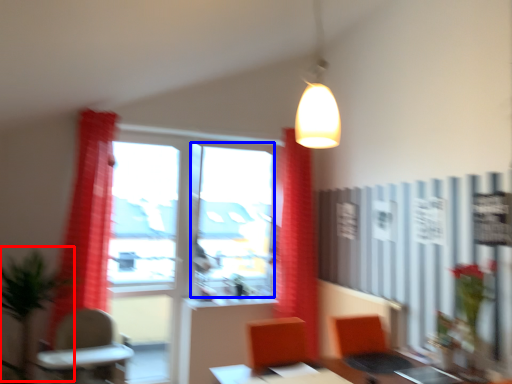
Question: Which of the following is the closest to the observer, plant (highlighted by a red box) or window screen (highlighted by a blue box)?

Choices:
 (A) plant
 (B) window screen

Answer: (A)